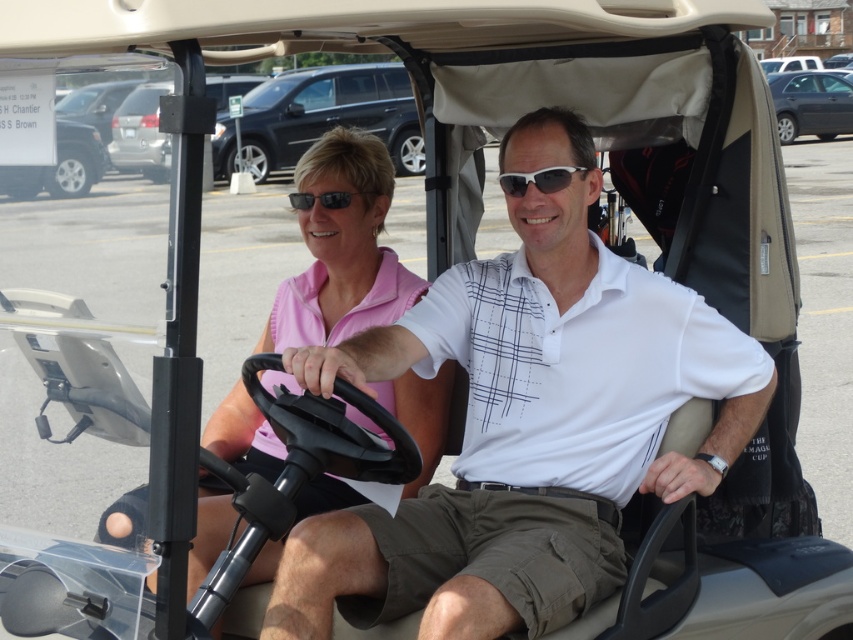
Question: Which point is farther to the camera?

Choices:
 (A) pink fabric shirt at center
 (B) sunglasses at center
 (C) black matte sunglasses at center

Answer: (C)

Question: Is pink fabric shirt at center above black matte sunglasses at center?

Choices:
 (A) yes
 (B) no

Answer: (B)

Question: Based on their relative distances, which object is farther from the pink fabric shirt at center?

Choices:
 (A) sunglasses at center
 (B) black matte sunglasses at center

Answer: (A)

Question: Based on their relative distances, which object is farther from the pink fabric shirt at center?

Choices:
 (A) sunglasses at center
 (B) black matte sunglasses at center

Answer: (A)

Question: Can you confirm if pink fabric shirt at center is thinner than sunglasses at center?

Choices:
 (A) no
 (B) yes

Answer: (A)

Question: Observing the image, what is the correct spatial positioning of pink fabric shirt at center in reference to black matte sunglasses at center?

Choices:
 (A) above
 (B) below

Answer: (B)